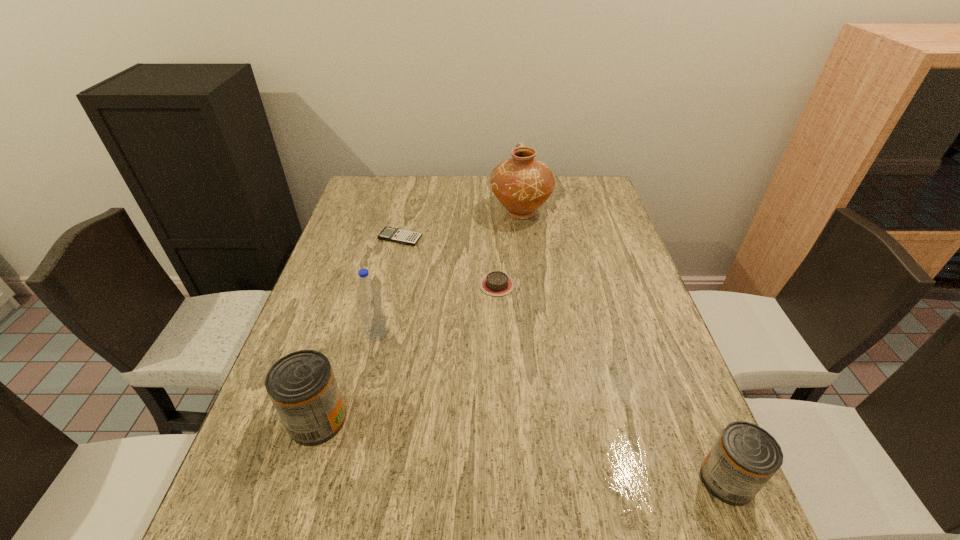
You are a GUI agent. You are given a task and a screenshot of the screen. Output one action in this format:
    pyautogui.click(x=<x>, y=<y>)
    Task: Click on the fifth farthest object
    This screenshot has width=960, height=540.
    Given the screenshot: What is the action you would take?
    pyautogui.click(x=301, y=385)

Identify the location of the left can. This screenshot has width=960, height=540. (301, 385).

Image resolution: width=960 pixels, height=540 pixels. I want to click on the right can, so click(x=745, y=456).

Locate an element on the screen. The height and width of the screenshot is (540, 960). the rightmost object is located at coordinates (745, 456).

Image resolution: width=960 pixels, height=540 pixels. In order to click on pottery in this screenshot , I will do `click(522, 184)`.

Locate an element on the screen. the fourth nearest object is located at coordinates (497, 283).

Image resolution: width=960 pixels, height=540 pixels. In order to click on the fifth tallest object in this screenshot , I will do `click(497, 283)`.

Find the location of a particular element. the shortest object is located at coordinates (401, 236).

Where is `water bottle`? This screenshot has width=960, height=540. water bottle is located at coordinates (372, 314).

Find the location of a particular element. This screenshot has width=960, height=540. free point located on the back of the third tallest object is located at coordinates (336, 359).